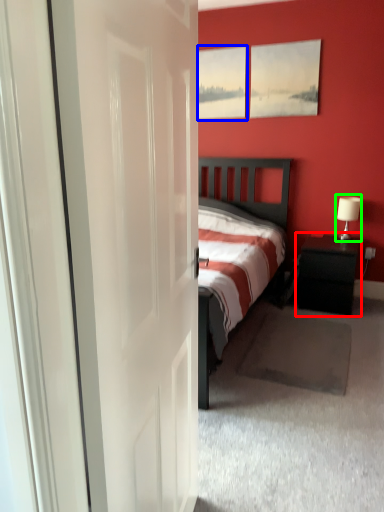
Question: Which object is the closest to the nightstand (highlighted by a red box)? Choose among these: window (highlighted by a blue box) or table lamp (highlighted by a green box).

Choices:
 (A) window
 (B) table lamp

Answer: (B)